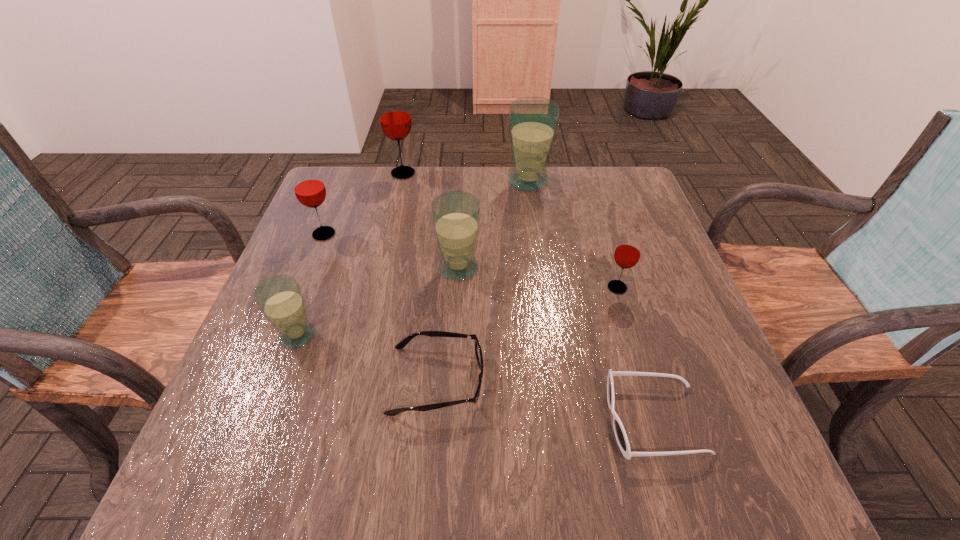
This screenshot has width=960, height=540. I want to click on the nearest blue glass, so click(280, 298).

Find the location of a particular element. the smallest blue glass is located at coordinates (280, 298).

The width and height of the screenshot is (960, 540). Find the location of `black sunglasses`. black sunglasses is located at coordinates (620, 434).

Locate an element on the screen. Image resolution: width=960 pixels, height=540 pixels. spectacles is located at coordinates (478, 352).

The image size is (960, 540). Find the location of `free space located on the front of the second red glass from right to left`. free space located on the front of the second red glass from right to left is located at coordinates (386, 249).

You are a GUI agent. You are given a task and a screenshot of the screen. Output one action in this format:
    pyautogui.click(x=<x>, y=<y>)
    Task: Click on the free point located on the right of the farthest blue glass
    The image size is (960, 540).
    Given the screenshot: What is the action you would take?
    pyautogui.click(x=578, y=181)

Where is `free spot located on the back of the third farthest object`? This screenshot has width=960, height=540. free spot located on the back of the third farthest object is located at coordinates (349, 170).

The height and width of the screenshot is (540, 960). I want to click on vacant area situated 0.110m on the right of the fourth glass from left to right, so click(528, 268).

You are a GUI agent. You are given a task and a screenshot of the screen. Output one action in this format:
    pyautogui.click(x=<x>, y=<y>)
    Task: Click on the vacant position located 0.080m on the back of the nearest red glass
    The width and height of the screenshot is (960, 540).
    Given the screenshot: What is the action you would take?
    pyautogui.click(x=608, y=255)

The image size is (960, 540). In order to click on vacant space situated on the right of the nearest blue glass in this screenshot , I will do `click(367, 335)`.